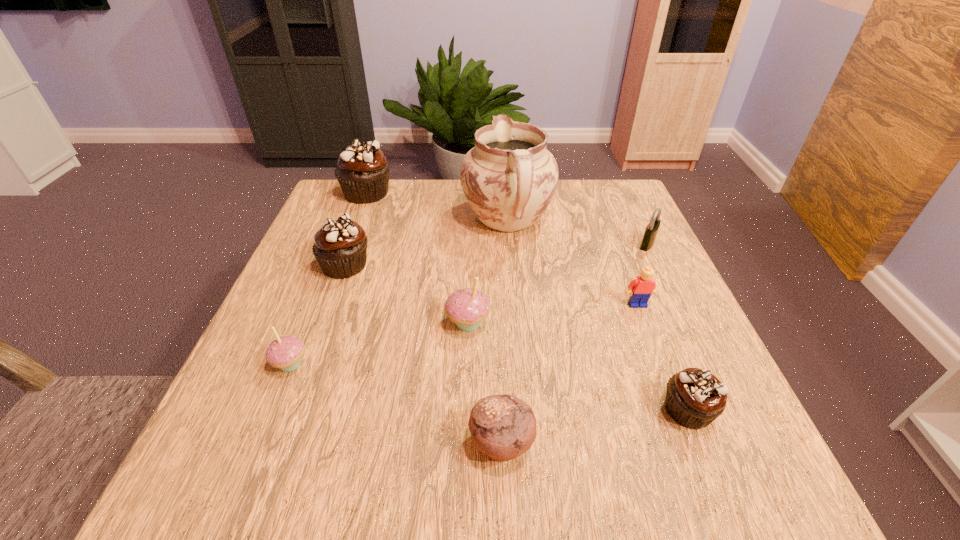
Find the location of a particular element. Image resolution: width=960 pixels, height=540 pixels. free space at the far edge is located at coordinates (405, 195).

Locate an element on the screen. free region at the near edge is located at coordinates (583, 455).

Locate an element on the screen. This screenshot has height=540, width=960. vacant space at the left edge is located at coordinates (291, 303).

In the image, there is a desktop. In order to click on vacant space at the right edge in this screenshot , I will do `click(600, 254)`.

In the image, there is a desktop. At what (x,y) coordinates should I click in order to perform the action: click on free region at the far left corner. Please return your answer as a coordinate pair (x, y). This screenshot has height=540, width=960. Looking at the image, I should click on (368, 219).

Find the location of a particular element. Image resolution: width=960 pixels, height=540 pixels. free space at the far right corner is located at coordinates (610, 213).

In the image, there is a desktop. Where is `vacant space at the near right corner`? vacant space at the near right corner is located at coordinates (767, 485).

Find the location of a particular element. The height and width of the screenshot is (540, 960). free space that is in between the farther pink cupcake and the biggest brown cupcake is located at coordinates (417, 258).

Where is `free point between the tallest object and the Lego`? The height and width of the screenshot is (540, 960). free point between the tallest object and the Lego is located at coordinates (572, 262).

Where is `free space between the muffin and the biggest brown cupcake`? free space between the muffin and the biggest brown cupcake is located at coordinates (434, 318).